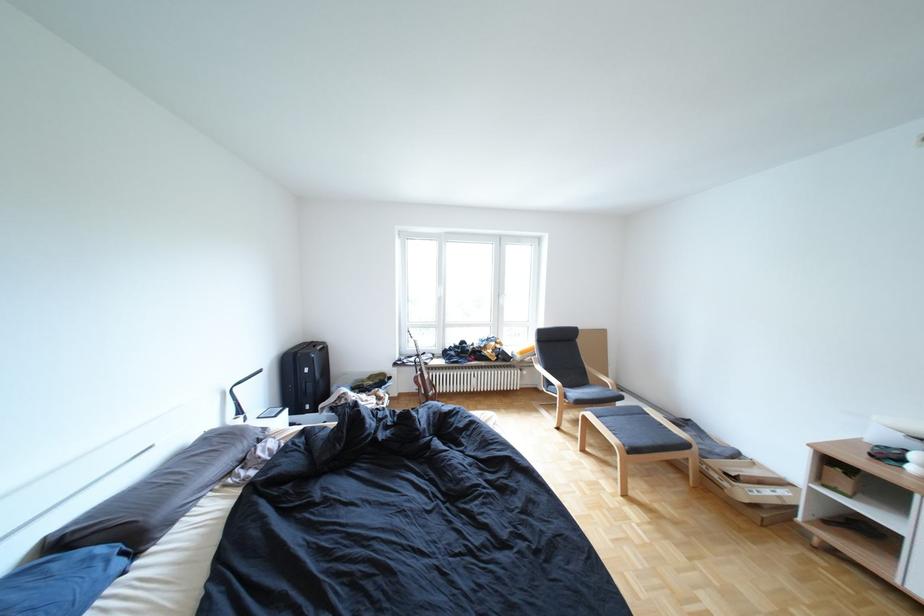
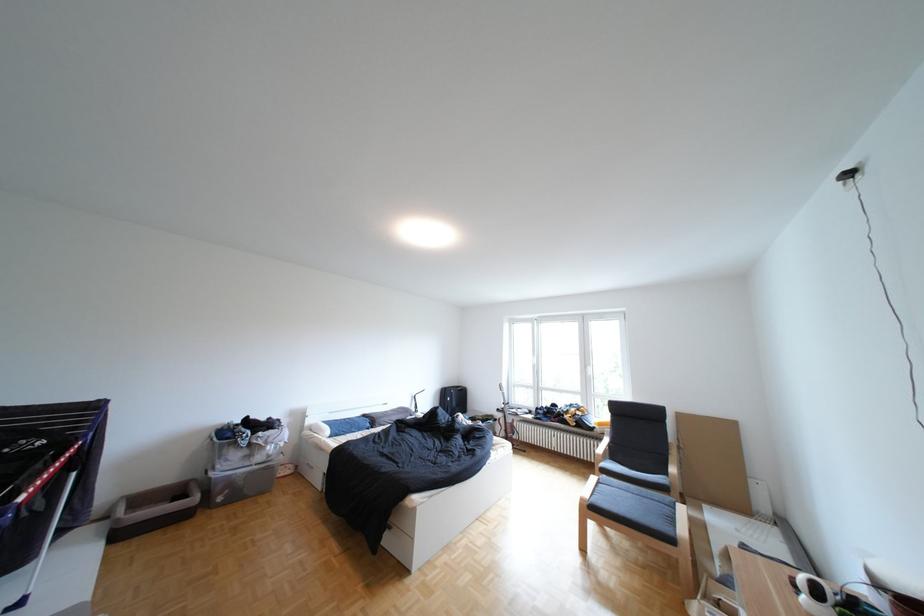
Question: I am providing you with two images of the same scene from different viewpoints. After the viewpoint changes to image2, which objects are now occluded?

Choices:
 (A) white headphones
 (B) white window handle
 (C) brown storage bin
 (D) none of these

Answer: (D)